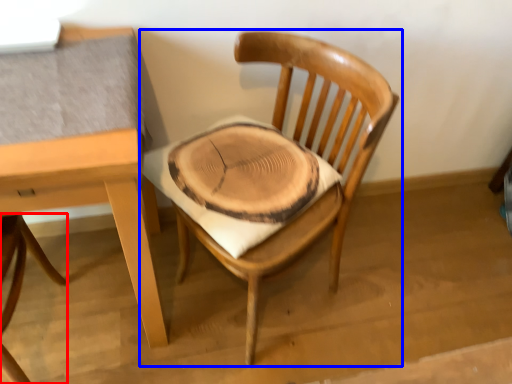
Question: Among these objects, which one is farthest to the camera, chair (highlighted by a red box) or chair (highlighted by a blue box)?

Choices:
 (A) chair
 (B) chair

Answer: (B)